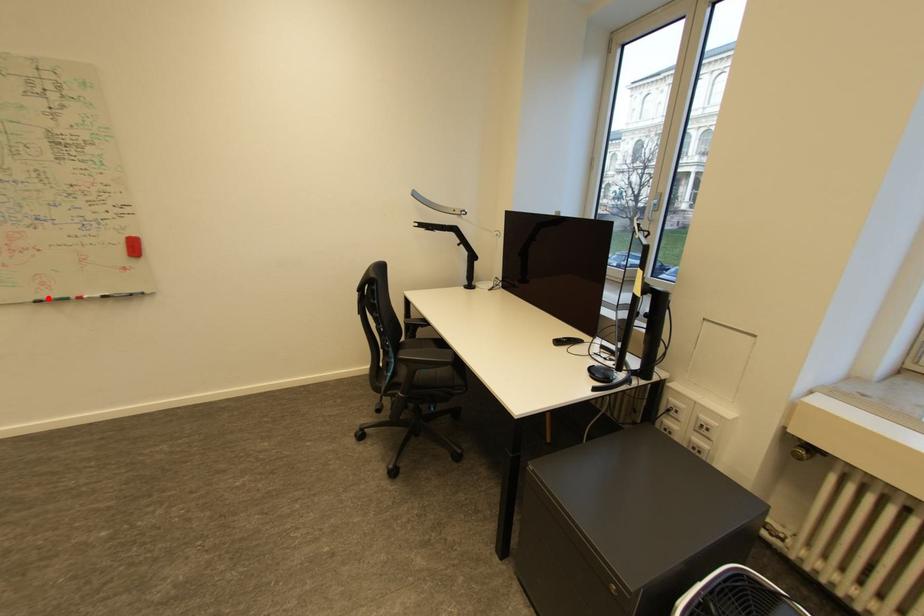
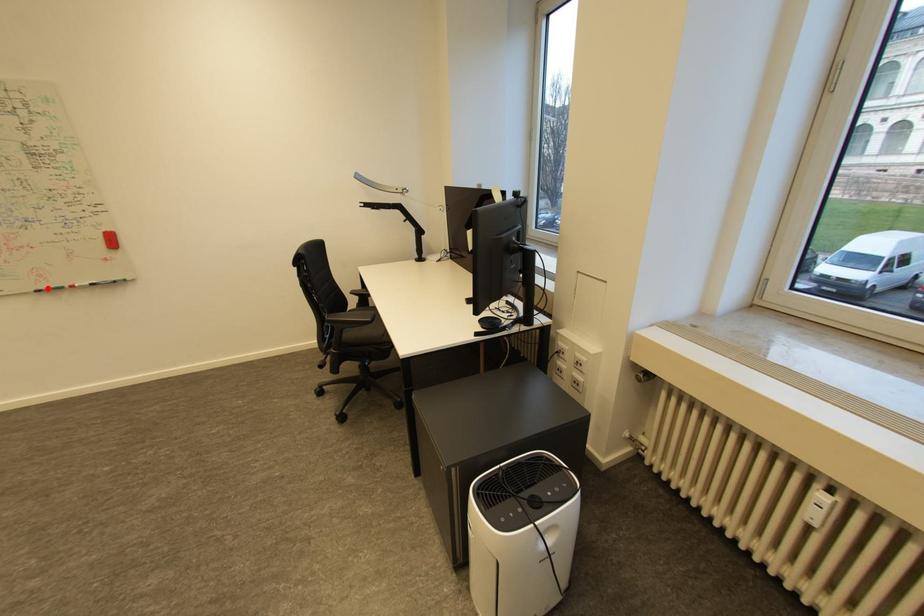
I am providing you with two images of the same scene from different viewpoints. A red point is marked on the first image and another point is marked on the second image. Do the highlighted points in image1 and image2 indicate the same real-world spot?

Yes